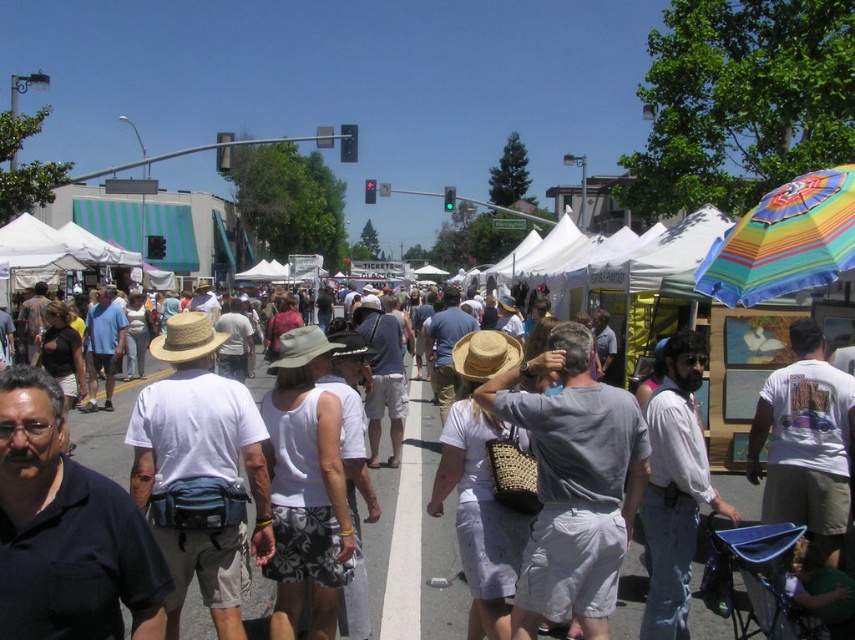
Who is more distant from viewer, (370, 586) or (761, 209)?

The point (370, 586) is behind.

Image resolution: width=855 pixels, height=640 pixels. Find the location of `matte white tent at center`. matte white tent at center is located at coordinates (433, 540).